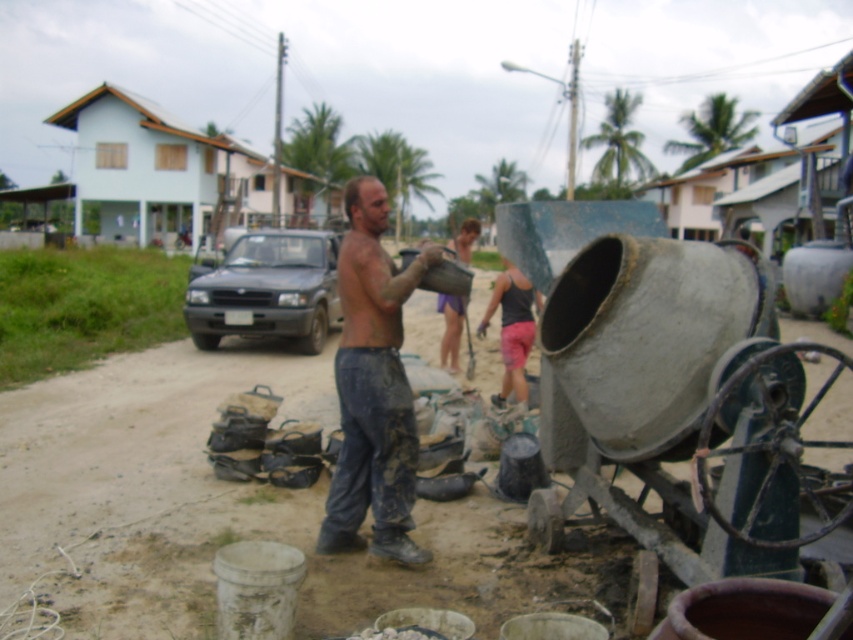
You are a construction worker wearing a dark gray tank top at center and muddy pants at center. You need to step aside to let a colleague pass. Which clothing item would you adjust to ensure there is enough space for the colleague? Explain your reasoning based on the spatial relationship between the two items.

The muddy pants at center are wider than the dark gray tank top at center. To create more space for the colleague, you should adjust the muddy pants at center since they occupy a larger width and moving them aside would free up more room.